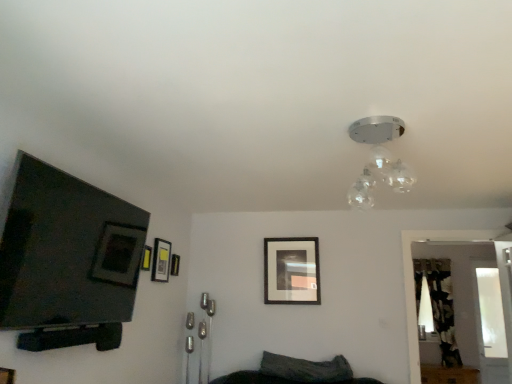
Question: Is matte black picture frame at center, the first picture frame positioned from the back, next to transparent glass door at right?

Choices:
 (A) yes
 (B) no

Answer: (B)

Question: From the image's perspective, is matte black picture frame at center, the first picture frame positioned from the back, on top of transparent glass door at right?

Choices:
 (A) no
 (B) yes

Answer: (B)

Question: Is matte black picture frame at center, which is the 4th picture frame in left-to-right order, further to the viewer compared to transparent glass door at right?

Choices:
 (A) no
 (B) yes

Answer: (B)

Question: Is matte black picture frame at center, which is counted as the fourth picture frame, starting from the front, turned away from transparent glass door at right?

Choices:
 (A) no
 (B) yes

Answer: (A)

Question: Considering the relative sizes of matte black picture frame at center, the first picture frame positioned from the back, and transparent glass door at right in the image provided, is matte black picture frame at center, the first picture frame positioned from the back, smaller than transparent glass door at right?

Choices:
 (A) no
 (B) yes

Answer: (B)

Question: Considering the positions of matte black picture frame at upper left, positioned as the 1th picture frame in front-to-back order, and transparent glass door at right in the image, is matte black picture frame at upper left, positioned as the 1th picture frame in front-to-back order, wider or thinner than transparent glass door at right?

Choices:
 (A) thin
 (B) wide

Answer: (A)

Question: Would you say matte black picture frame at upper left, positioned as the 1th picture frame in front-to-back order, is to the left or to the right of transparent glass door at right in the picture?

Choices:
 (A) left
 (B) right

Answer: (A)

Question: From a real-world perspective, relative to transparent glass door at right, is matte black picture frame at upper left, which is the 4th picture frame in right-to-left order, vertically above or below?

Choices:
 (A) below
 (B) above

Answer: (B)

Question: Relative to transparent glass door at right, is matte black picture frame at upper left, the fourth picture frame in the back-to-front sequence, in front or behind?

Choices:
 (A) front
 (B) behind

Answer: (A)

Question: In terms of height, does transparent glass door at right look taller or shorter compared to clear glass light fixture at upper center?

Choices:
 (A) tall
 (B) short

Answer: (A)

Question: Does point (489, 337) appear closer or farther from the camera than point (365, 200)?

Choices:
 (A) closer
 (B) farther

Answer: (B)

Question: Is transparent glass door at right in front of or behind clear glass light fixture at upper center in the image?

Choices:
 (A) behind
 (B) front

Answer: (A)

Question: In terms of size, does transparent glass door at right appear bigger or smaller than clear glass light fixture at upper center?

Choices:
 (A) big
 (B) small

Answer: (A)

Question: Would you say transparent glass door at right is inside or outside matte black picture frame at upper left, the fourth picture frame in the back-to-front sequence?

Choices:
 (A) inside
 (B) outside

Answer: (B)

Question: Looking at their shapes, would you say transparent glass door at right is wider or thinner than matte black picture frame at upper left, which is the 4th picture frame in right-to-left order?

Choices:
 (A) thin
 (B) wide

Answer: (B)